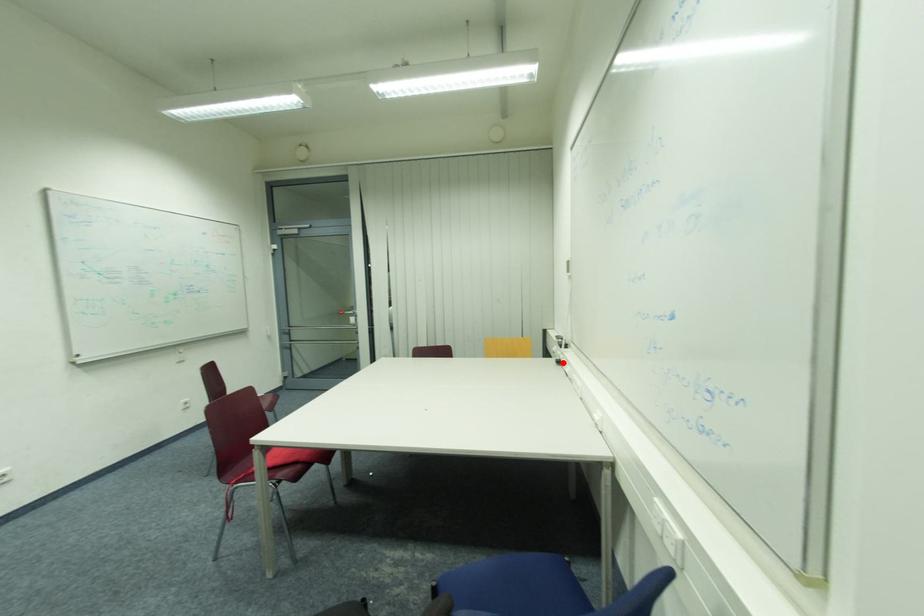
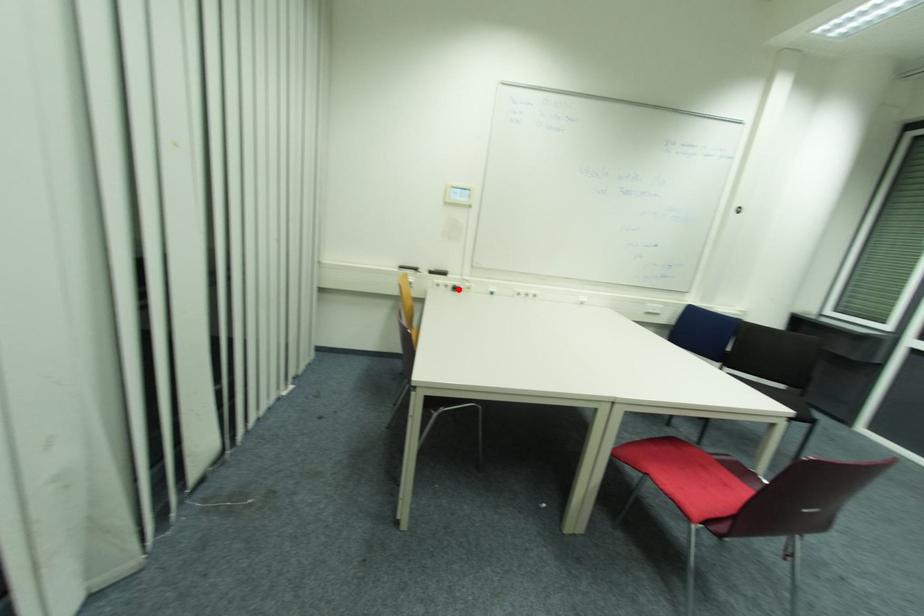
I am providing you with two images of the same scene from different viewpoints. A red point is marked on the first image and another point is marked on the second image. Do the highlighted points in image1 and image2 indicate the same real-world spot?

Yes